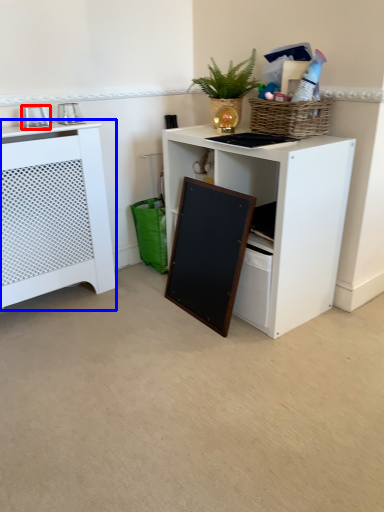
Question: Which object appears closest to the camera in this image, appliance (highlighted by a red box) or cabinetry (highlighted by a blue box)?

Choices:
 (A) appliance
 (B) cabinetry

Answer: (B)